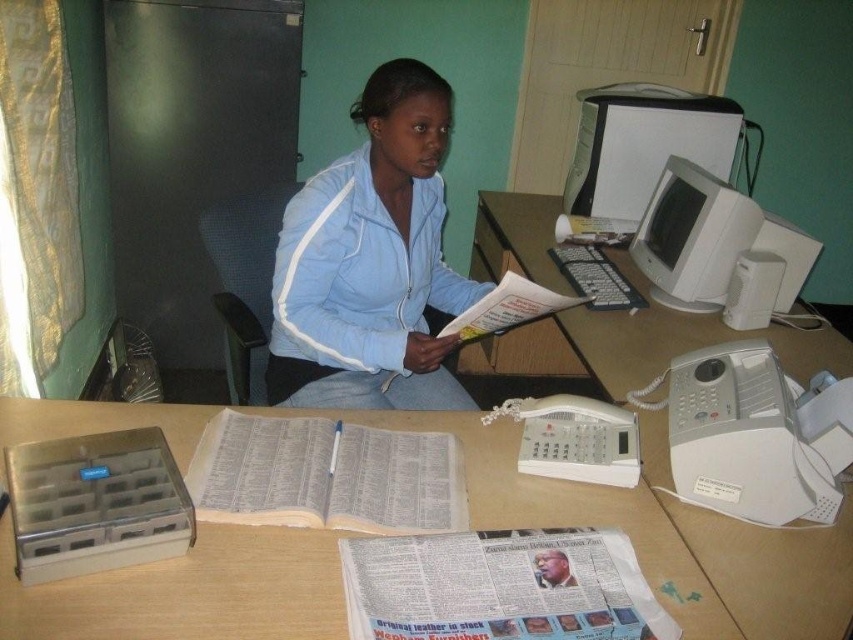
Question: Can you confirm if white plastic telephone at center is smaller than white paper at center?

Choices:
 (A) yes
 (B) no

Answer: (B)

Question: Which of these objects is positioned closest to the wooden table at center?

Choices:
 (A) white plastic telephone at center
 (B) white paper newspaper at center

Answer: (B)

Question: Which of the following is the closest to the observer?

Choices:
 (A) (314, 600)
 (B) (743, 220)

Answer: (A)

Question: Which of the following is the closest to the observer?

Choices:
 (A) (445, 326)
 (B) (738, 216)

Answer: (A)

Question: Does white paper book at center appear over white plastic monitor at upper center?

Choices:
 (A) yes
 (B) no

Answer: (B)

Question: Is wooden table at center to the right of light blue zip-up jacket at center from the viewer's perspective?

Choices:
 (A) no
 (B) yes

Answer: (A)